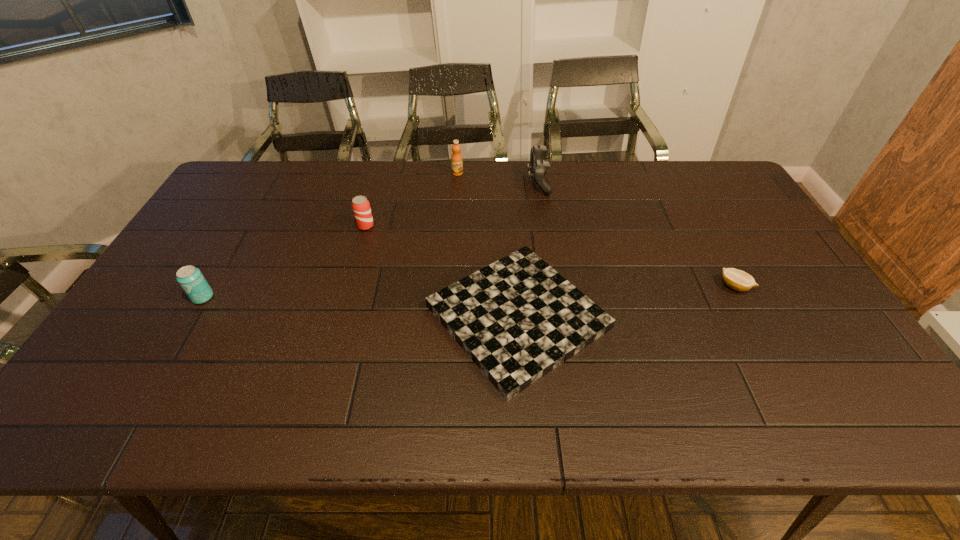
You are a GUI agent. You are given a task and a screenshot of the screen. Output one action in this format:
    pyautogui.click(x=<x>, y=<y>)
    Task: Click on the free region located on the surface of the control with buttons
    This screenshot has width=960, height=540.
    Given the screenshot: What is the action you would take?
    pyautogui.click(x=449, y=182)

The image size is (960, 540). I want to click on vacant region located on the surface of the control with buttons, so 501,182.

Image resolution: width=960 pixels, height=540 pixels. Identify the location of vacant region located 0.330m on the surface of the control with buttons. (432, 182).

Find the location of a particular element. free space located 0.050m on the back of the right beer can is located at coordinates (370, 211).

Where is `free spot located 0.240m on the front of the left beer can`? The image size is (960, 540). free spot located 0.240m on the front of the left beer can is located at coordinates (151, 387).

Locate an element on the screen. The height and width of the screenshot is (540, 960). free space located on the left of the rightmost object is located at coordinates (665, 286).

At what (x,y) coordinates should I click in order to perform the action: click on free location located 0.200m on the right of the shortest object. Please return your answer as a coordinate pair (x, y). Looking at the image, I should click on (688, 317).

The height and width of the screenshot is (540, 960). I want to click on orange juice that is positioned at the far edge, so click(456, 160).

Identify the location of control positioned at the far edge. (538, 167).

Where is `object that is at the near edge`? This screenshot has width=960, height=540. object that is at the near edge is located at coordinates (518, 319).